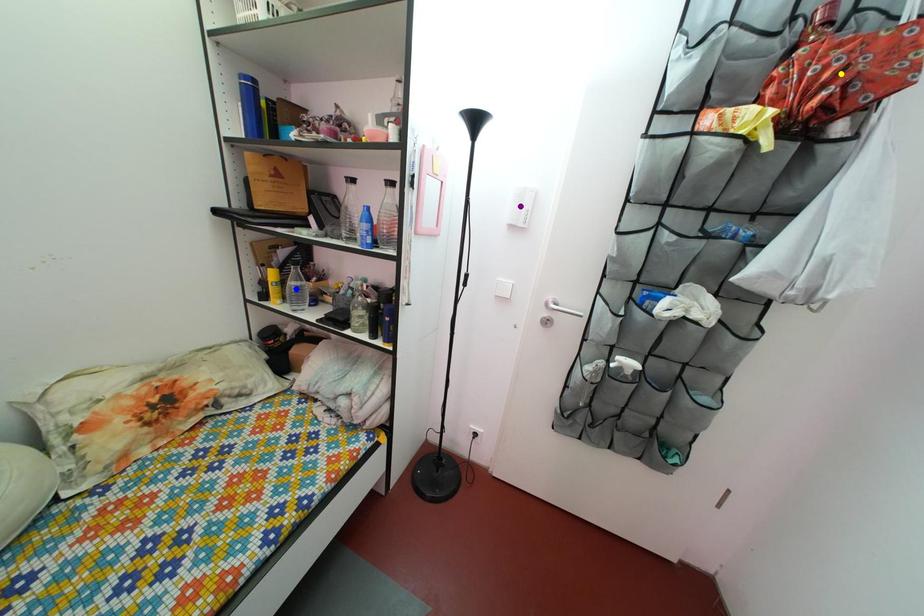
Order these from nearest to farthest:
yellow point | blue point | purple point

1. blue point
2. purple point
3. yellow point